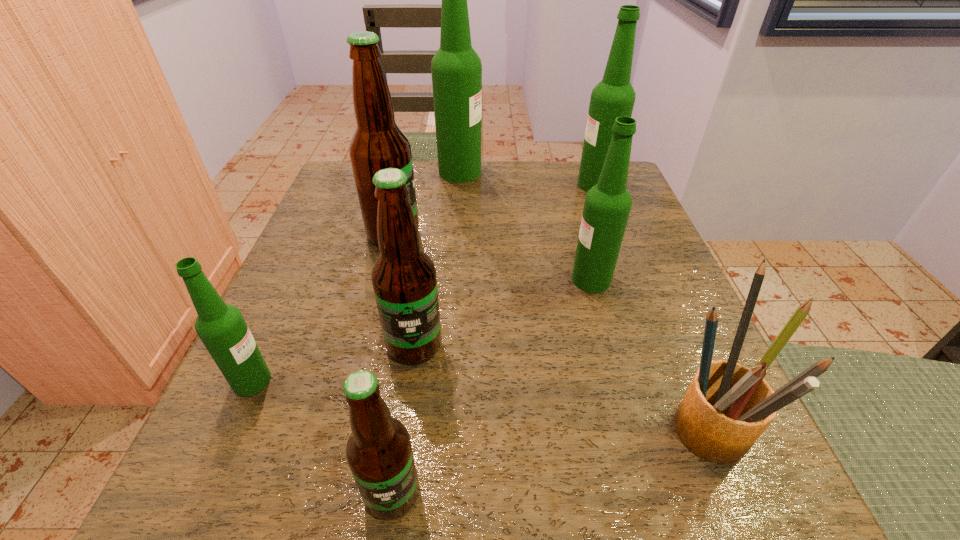
Select which brown beer bottle is the third closest to the third smallest green beer bottle. Please provide its 2D coordinates. Your answer should be formatted as a tuple, i.e. [(x, y)], where the tuple contains the x and y coordinates of a point satisfying the conditions above.

[(379, 453)]

At what (x,y) coordinates should I click in order to perform the action: click on the second closest brown beer bottle relative to the biggest brown beer bottle. Please return your answer as a coordinate pair (x, y). The image size is (960, 540). Looking at the image, I should click on point(379,453).

Where is `free location that satisfies the following two spatial constraints: 1. on the label of the second green beer bottle from left to right; 2. on the label of the second nearest brown beer bottle`? This screenshot has height=540, width=960. free location that satisfies the following two spatial constraints: 1. on the label of the second green beer bottle from left to right; 2. on the label of the second nearest brown beer bottle is located at coordinates (448, 345).

Locate an element on the screen. free space that satisfies the following two spatial constraints: 1. on the label of the third green beer bottle from right to left; 2. on the label of the nearest brown beer bottle is located at coordinates (438, 493).

This screenshot has height=540, width=960. What are the coordinates of `vacant space that satisfies the following two spatial constraints: 1. on the label of the leftmost beer bottle; 2. on the back side of the pencil box` in the screenshot? It's located at (232, 422).

Where is `free space that satisfies the following two spatial constraints: 1. on the label of the third farthest object; 2. on the left side of the pencil box`? Image resolution: width=960 pixels, height=540 pixels. free space that satisfies the following two spatial constraints: 1. on the label of the third farthest object; 2. on the left side of the pencil box is located at coordinates (348, 422).

Find the location of a particular element. vacant space that satisfies the following two spatial constraints: 1. on the label of the fifth nearest object; 2. on the left side of the brown pencil box is located at coordinates (631, 422).

What are the coordinates of `vacant region that satisfies the following two spatial constraints: 1. on the label of the tallest beer bottle; 2. on the label of the second smallest brown beer bottle` in the screenshot? It's located at (448, 345).

At what (x,y) coordinates should I click in order to perform the action: click on free spot that satisfies the following two spatial constraints: 1. on the label of the biggest green beer bottle; 2. on the label of the nearest beer bottle. Please return your answer as a coordinate pair (x, y). The width and height of the screenshot is (960, 540). Looking at the image, I should click on (438, 493).